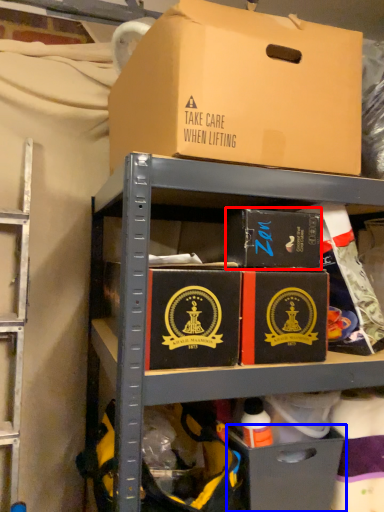
Question: Among these objects, which one is nearest to the camera, box (highlighted by a red box) or drawer (highlighted by a blue box)?

Choices:
 (A) box
 (B) drawer

Answer: (A)